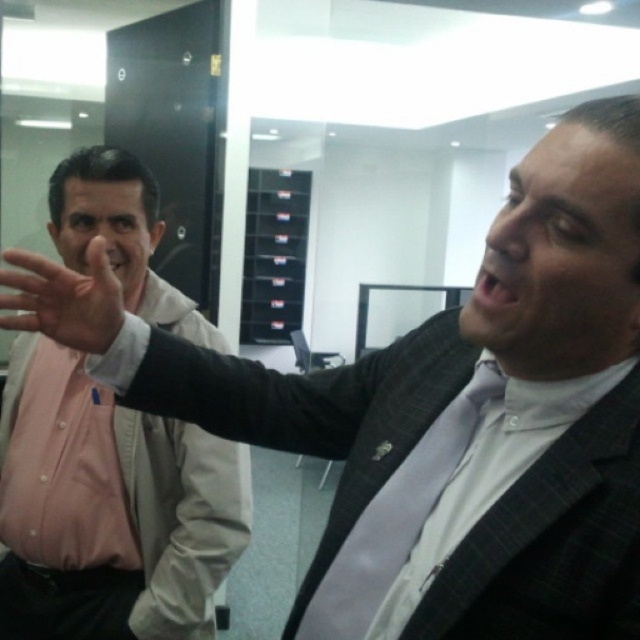
Looking at this image, you are a delivery person who needs to place a small package between the pink shirt at left and the matte skin hand at center. The package is 50 centimeters long. Is there enough space between them to fit the package?

The distance between the pink shirt at left and the matte skin hand at center is 54.17 centimeters. Since the package is 50 centimeters long, there is enough space to fit it between them.